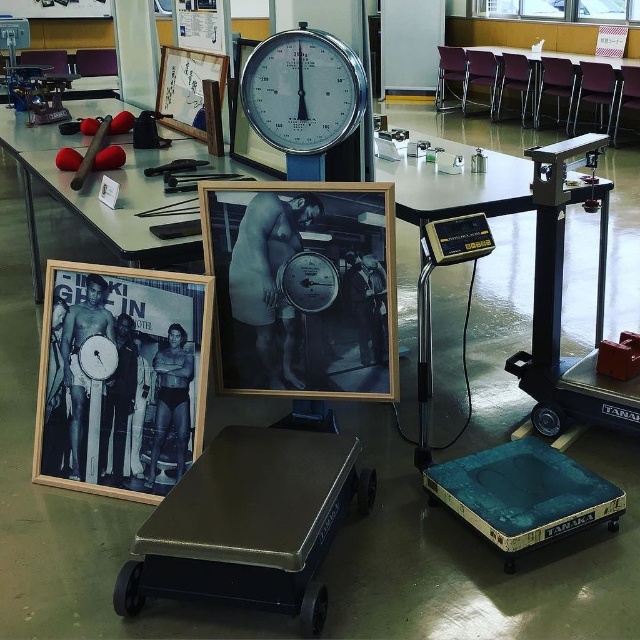
Question: Considering the real-world distances, which object is farthest from the metallic gray scale at right?

Choices:
 (A) wooden frame at left
 (B) metallic silver scale at center
 (C) rubber mat at upper left
 (D) matte wooden picture frame at upper center

Answer: (C)

Question: In this image, where is black wood picture frame at center located relative to metallic/reflective table at center?

Choices:
 (A) below
 (B) above

Answer: (A)

Question: Which object is farther from the camera taking this photo?

Choices:
 (A) metallic/reflective table at center
 (B) matte wooden picture frame at upper center
 (C) wooden frame at left
 (D) rubber mat at upper left

Answer: (A)

Question: Which object is the farthest from the metallic black cart at center?

Choices:
 (A) wooden frame at left
 (B) metallic silver scale at center
 (C) rubber mat at upper left

Answer: (C)

Question: Can you confirm if metallic black cart at center is thinner than matte wooden picture frame at upper center?

Choices:
 (A) no
 (B) yes

Answer: (A)

Question: Observing the image, what is the correct spatial positioning of wooden frame at left in reference to rubber mat at upper left?

Choices:
 (A) right
 (B) left

Answer: (A)